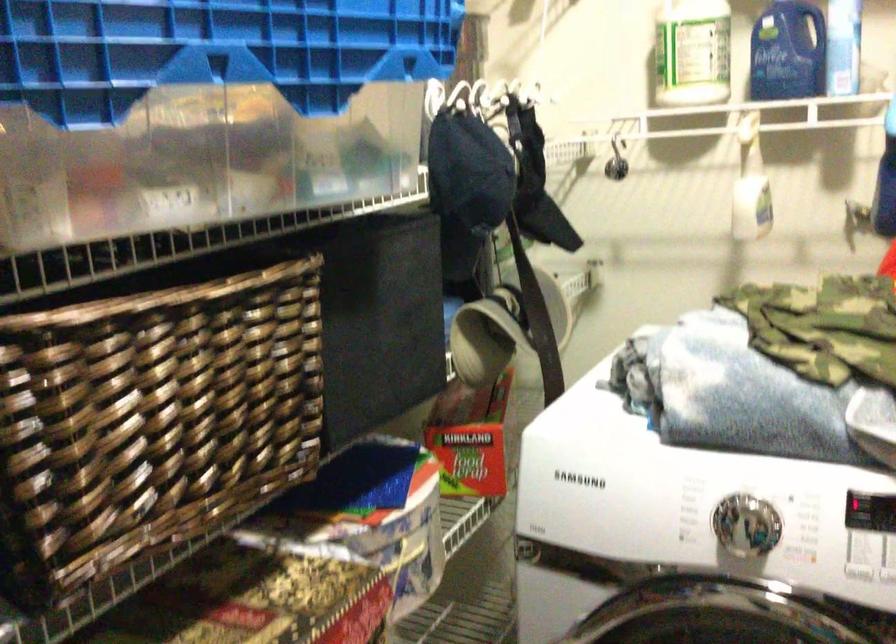
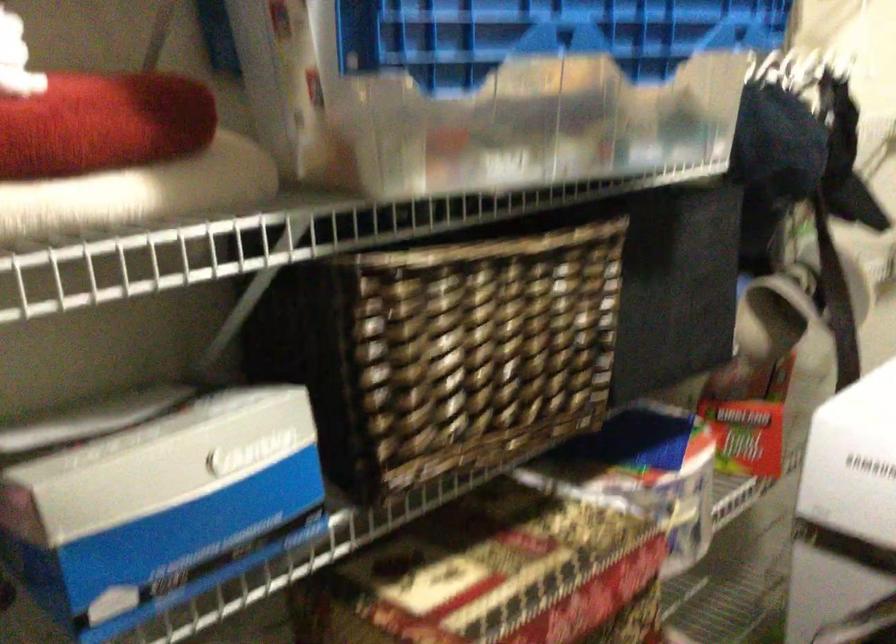
Find the pixel in the second image that matches (131,162) in the first image.

(468, 114)